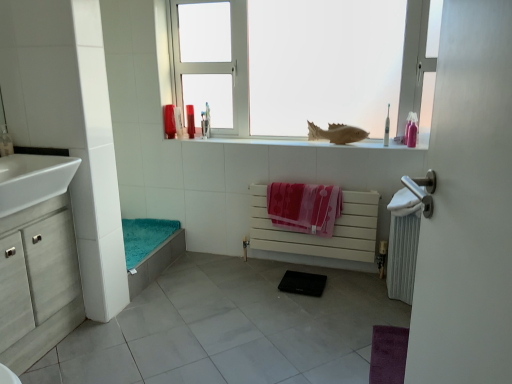
What do you see at coordinates (298, 143) in the screenshot? I see `white matte window sill at upper center` at bounding box center [298, 143].

What do you see at coordinates (169, 121) in the screenshot? This screenshot has width=512, height=384. I see `matte plastic bottle at upper center, which is counted as the second toiletry, starting from the left` at bounding box center [169, 121].

This screenshot has width=512, height=384. Identify the location of translucent plastic cup at upper center, placed as the third toiletry when sorted from left to right. (178, 122).

The width and height of the screenshot is (512, 384). Describe the element at coordinates (387, 128) in the screenshot. I see `pink plastic toothbrush at upper right, placed as the fourth toiletry when sorted from back to front` at that location.

Find the location of a particular element. matte plastic soap dispenser at upper left, arranged as the 6th toiletry when viewed from the right is located at coordinates (5, 142).

Locate an element on the screen. The height and width of the screenshot is (384, 512). white matte window sill at upper center is located at coordinates (298, 143).

In terms of width, does white matte window at upper center look wider or thinner when compared to pink matte bottle at upper right, placed as the 2th toiletry when sorted from front to back?

Considering their sizes, white matte window at upper center looks broader than pink matte bottle at upper right, placed as the 2th toiletry when sorted from front to back.

Is the depth of white matte window at upper center greater than that of pink matte bottle at upper right, which ranks as the sixth toiletry in left-to-right order?

No, it is not.

Does white matte window at upper center have a lesser height compared to pink matte bottle at upper right, placed as the 2th toiletry when sorted from front to back?

No.

Is pink matte bottle at upper right, placed as the 2th toiletry when sorted from front to back, surrounded by white matte window at upper center?

No, pink matte bottle at upper right, placed as the 2th toiletry when sorted from front to back, is not a part of white matte window at upper center.

How far apart are matte plastic bottle at upper center, arranged as the second toiletry when viewed from the back, and matte plastic soap dispenser at upper left, which appears as the first toiletry when viewed from the front?

matte plastic bottle at upper center, arranged as the second toiletry when viewed from the back, is 1.05 meters from matte plastic soap dispenser at upper left, which appears as the first toiletry when viewed from the front.

Based on the photo, which is more to the left, matte plastic bottle at upper center, arranged as the second toiletry when viewed from the back, or matte plastic soap dispenser at upper left, which is the 1th toiletry in left-to-right order?

From the viewer's perspective, matte plastic soap dispenser at upper left, which is the 1th toiletry in left-to-right order, appears more on the left side.

Can you confirm if matte plastic bottle at upper center, the 5th toiletry when ordered from front to back, is taller than matte plastic soap dispenser at upper left, arranged as the 6th toiletry when viewed from the right?

Indeed, matte plastic bottle at upper center, the 5th toiletry when ordered from front to back, has a greater height compared to matte plastic soap dispenser at upper left, arranged as the 6th toiletry when viewed from the right.

From the image's perspective, which one is positioned higher, matte plastic bottle at upper center, acting as the 5th toiletry starting from the right, or matte plastic soap dispenser at upper left, which appears as the first toiletry when viewed from the front?

matte plastic bottle at upper center, acting as the 5th toiletry starting from the right, is shown above in the image.

Is matte brown fish at upper center facing towards matte plastic soap dispenser at upper left, the sixth toiletry viewed from the back?

No, matte brown fish at upper center does not turn towards matte plastic soap dispenser at upper left, the sixth toiletry viewed from the back.

From a real-world perspective, is matte brown fish at upper center located beneath matte plastic soap dispenser at upper left, which is the 1th toiletry in left-to-right order?

Yes, from a real-world perspective, matte brown fish at upper center is beneath matte plastic soap dispenser at upper left, which is the 1th toiletry in left-to-right order.

In the scene shown: Is matte brown fish at upper center surrounding matte plastic soap dispenser at upper left, which appears as the first toiletry when viewed from the front?

No, matte plastic soap dispenser at upper left, which appears as the first toiletry when viewed from the front, is not surrounded by matte brown fish at upper center.

Considering the relative positions of matte brown fish at upper center and matte plastic soap dispenser at upper left, which is the 1th toiletry in left-to-right order, in the image provided, is matte brown fish at upper center to the left of matte plastic soap dispenser at upper left, which is the 1th toiletry in left-to-right order, from the viewer's perspective?

No, matte brown fish at upper center is not to the left of matte plastic soap dispenser at upper left, which is the 1th toiletry in left-to-right order.

In terms of width, does white glossy sink at left look wider or thinner when compared to matte plastic cup at upper center, acting as the 1th toiletry starting from the back?

Clearly, white glossy sink at left has more width compared to matte plastic cup at upper center, acting as the 1th toiletry starting from the back.

Does white glossy sink at left have a larger size compared to matte plastic cup at upper center, the sixth toiletry from the front?

Yes.

Is matte plastic cup at upper center, acting as the 1th toiletry starting from the back, inside white glossy sink at left?

Definitely not — matte plastic cup at upper center, acting as the 1th toiletry starting from the back, is not inside white glossy sink at left.

In the scene shown: Is white glossy sink at left positioned with its back to matte plastic cup at upper center, the sixth toiletry from the front?

white glossy sink at left is not turned away from matte plastic cup at upper center, the sixth toiletry from the front.

Consider the image. Is pink matte bottle at upper right, arranged as the fifth toiletry when viewed from the back, aimed at translucent plastic cup at upper center, acting as the fourth toiletry starting from the front?

No, pink matte bottle at upper right, arranged as the fifth toiletry when viewed from the back, is not facing towards translucent plastic cup at upper center, acting as the fourth toiletry starting from the front.

From the image's perspective, which one is positioned higher, pink matte bottle at upper right, arranged as the fifth toiletry when viewed from the back, or translucent plastic cup at upper center, placed as the third toiletry when sorted from left to right?

From the image's view, translucent plastic cup at upper center, placed as the third toiletry when sorted from left to right, is above.

Which of these two, pink matte bottle at upper right, arranged as the first toiletry when viewed from the right, or translucent plastic cup at upper center, placed as the third toiletry when sorted from left to right, is thinner?

With smaller width is pink matte bottle at upper right, arranged as the first toiletry when viewed from the right.

From the image's perspective, does white matte window sill at upper center appear lower than white matte cabinet at left?

Actually, white matte window sill at upper center appears above white matte cabinet at left in the image.

Measure the distance between white matte window sill at upper center and white matte cabinet at left.

A distance of 1.34 meters exists between white matte window sill at upper center and white matte cabinet at left.

Where is `bathroom cabinet below the white matte window sill at upper center (from a real-world perspective)`? bathroom cabinet below the white matte window sill at upper center (from a real-world perspective) is located at coordinates coord(38,282).

Are white matte window sill at upper center and white matte cabinet at left far apart?

Yes, white matte window sill at upper center and white matte cabinet at left are located far from each other.

Does matte plastic cup at upper center, the 4th toiletry viewed from the left, have a smaller size compared to white matte cabinet at left?

Indeed, matte plastic cup at upper center, the 4th toiletry viewed from the left, has a smaller size compared to white matte cabinet at left.

Is white matte cabinet at left at the back of matte plastic cup at upper center, marked as the 3th toiletry in a right-to-left arrangement?

No, white matte cabinet at left is not at the back of matte plastic cup at upper center, marked as the 3th toiletry in a right-to-left arrangement.

Where is `toiletry that is the 6th object located behind the white matte cabinet at left`? The width and height of the screenshot is (512, 384). toiletry that is the 6th object located behind the white matte cabinet at left is located at coordinates (190, 121).

Find the location of `the 1st toiletry behind when counting from the white matte window at upper center`. the 1st toiletry behind when counting from the white matte window at upper center is located at coordinates (411, 130).

I want to click on the 4th toiletry in front of the matte plastic bottle at upper center, which is counted as the second toiletry, starting from the left, so click(5, 142).

Consider the image. Looking at the image, which one is located further to pink plastic toothbrush at upper right, placed as the fourth toiletry when sorted from back to front, pink fabric beach towel at center or white matte window sill at upper center?

The object further to pink plastic toothbrush at upper right, placed as the fourth toiletry when sorted from back to front, is pink fabric beach towel at center.

Considering their positions, is white matte cabinet at left positioned closer to white matte radiator at center, which ranks as the first radiator in left-to-right order, than white matte window at upper center?

white matte window at upper center.

When comparing their distances from matte plastic cup at upper center, the 4th toiletry viewed from the left, does matte plastic bottle at upper center, arranged as the second toiletry when viewed from the back, or pink matte bottle at upper right, placed as the 2th toiletry when sorted from front to back, seem closer?

Among the two, matte plastic bottle at upper center, arranged as the second toiletry when viewed from the back, is located nearer to matte plastic cup at upper center, the 4th toiletry viewed from the left.

Looking at this image, from the image, which object appears to be nearer to white metallic radiator at right, which is counted as the 1th radiator, starting from the right, white matte cabinet at left or matte plastic cup at upper center, the sixth toiletry from the front?

The object closer to white metallic radiator at right, which is counted as the 1th radiator, starting from the right, is matte plastic cup at upper center, the sixth toiletry from the front.

Based on their spatial positions, is pink plastic toothbrush at upper right, placed as the fourth toiletry when sorted from back to front, or white matte window at upper center further from white glossy sink at left?

pink plastic toothbrush at upper right, placed as the fourth toiletry when sorted from back to front, is positioned further to the anchor white glossy sink at left.

Consider the image. Estimate the real-world distances between objects in this image. Which object is further from white matte window at upper center, pink fabric beach towel at center or white glossy sink at left?

Among the two, white glossy sink at left is located further to white matte window at upper center.

Based on their spatial positions, is white matte cabinet at left or pink plastic toothbrush at upper right, the 2th toiletry from the right, further from pink matte bottle at upper right, arranged as the first toiletry when viewed from the right?

white matte cabinet at left.

Based on their spatial positions, is white metallic radiator at right, acting as the second radiator starting from the left, or white matte window sill at upper center further from translucent plastic cup at upper center, placed as the third toiletry when sorted from left to right?

white metallic radiator at right, acting as the second radiator starting from the left, is further to translucent plastic cup at upper center, placed as the third toiletry when sorted from left to right.

The height and width of the screenshot is (384, 512). In order to click on tile between white matte cabinet at left and pink matte bottle at upper right, arranged as the fifth toiletry when viewed from the back, from left to right in this screenshot , I will do `click(230, 329)`.

The width and height of the screenshot is (512, 384). I want to click on beach towel located between white glossy sink at left and translucent plastic cup at upper center, which is counted as the third toiletry, starting from the back, in the depth direction, so click(x=304, y=207).

Locate an element on the screen. bathroom cabinet between matte plastic soap dispenser at upper left, which is the 1th toiletry in left-to-right order, and matte brown fish at upper center from left to right is located at coordinates (38, 282).

Locate an element on the screen. The image size is (512, 384). beach towel that lies between pink plastic toothbrush at upper right, placed as the 5th toiletry when sorted from left to right, and white matte radiator at center, marked as the 2th radiator in a right-to-left arrangement, from top to bottom is located at coordinates (304, 207).